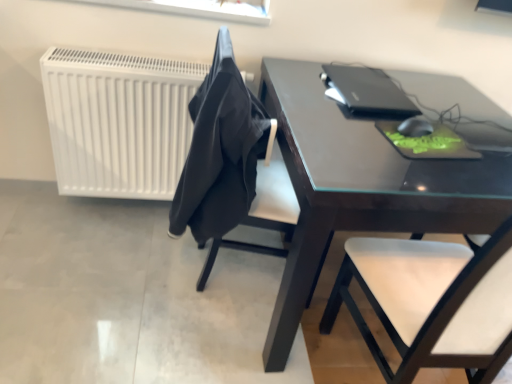
At what (x,y) coordinates should I click in order to perform the action: click on free space in front of black matte laptop at upper right. Please return your answer as a coordinate pair (x, y). Looking at the image, I should click on (350, 122).